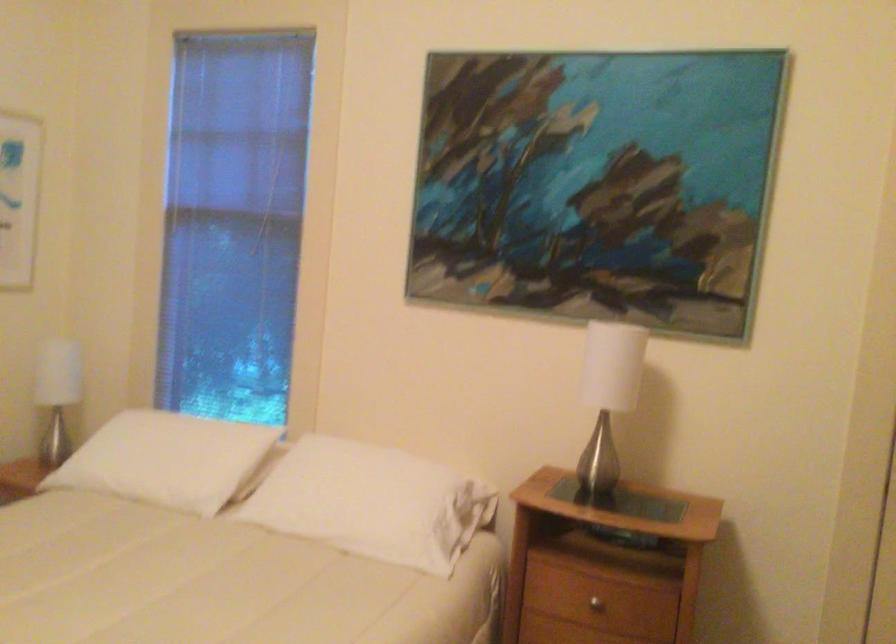
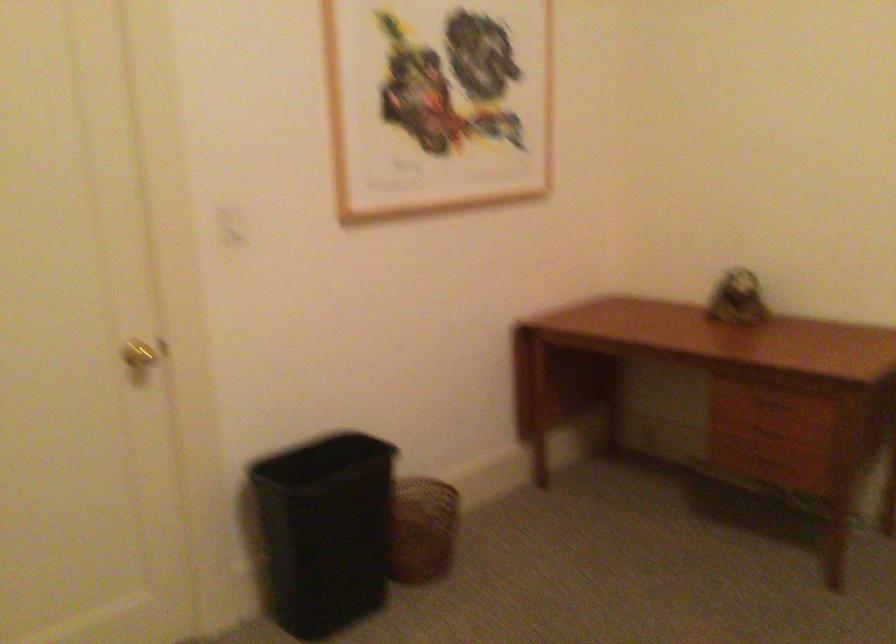
Question: How did the camera likely rotate?

Choices:
 (A) Left
 (B) Right
 (C) Up
 (D) Down

Answer: (A)